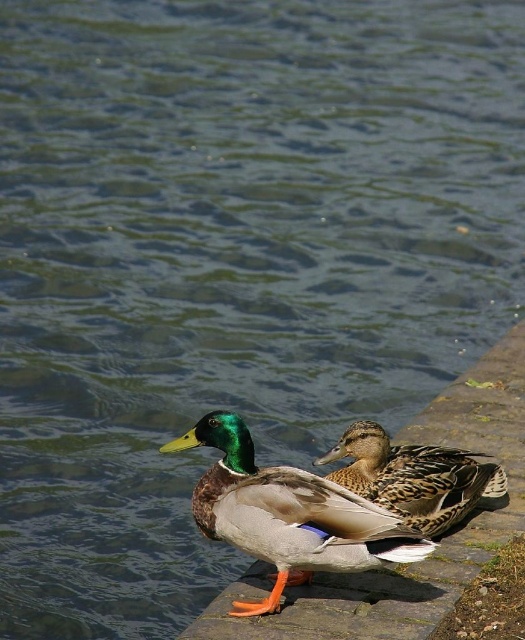
You are a birdwatcher trying to identify ducks based on their features. You see the shiny green head at center and the brown speckled feathers at center. Which duck has a wider head?

The shiny green head at center has a larger width than the brown speckled feathers at center, so the duck with the shiny green head at center has a wider head.

Consider the image. You are a birdwatcher observing two ducks on a stone ledge. You notice a shiny green head at center and brown speckled feathers at center. Which object is positioned lower in the image?

The shiny green head at center is located below brown speckled feathers at center, so it is positioned lower in the image.